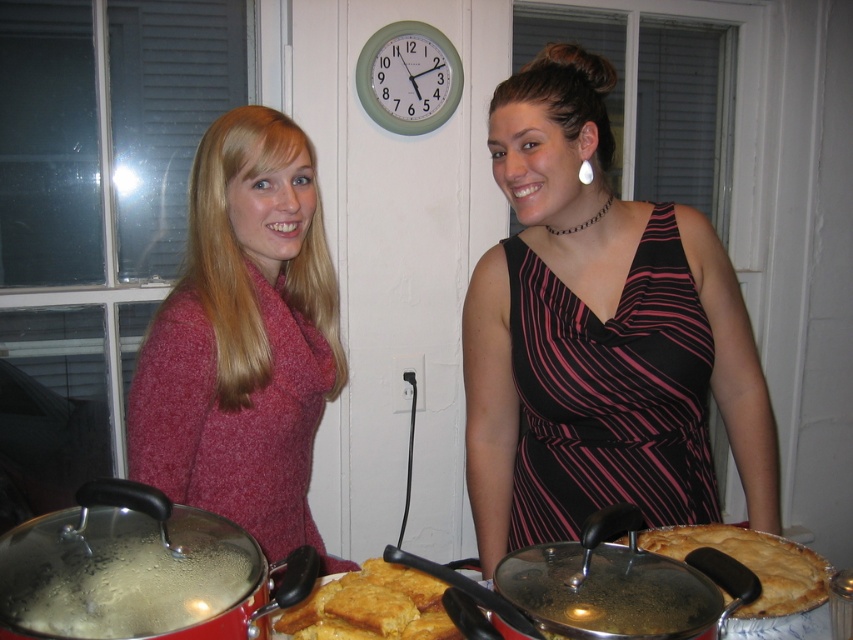
Question: Is black striped dress at center further to camera compared to golden brown crusty bread at center?

Choices:
 (A) yes
 (B) no

Answer: (A)

Question: Is matte red sweater at center closer to camera compared to golden brown crusty bread at center?

Choices:
 (A) no
 (B) yes

Answer: (A)

Question: In this image, where is black striped dress at center located relative to matte red sweater at center?

Choices:
 (A) left
 (B) right

Answer: (B)

Question: Which object is positioned farthest from the black striped dress at center?

Choices:
 (A) golden flaky pie at center right
 (B) matte red sweater at center
 (C) golden brown crusty bread at center

Answer: (C)

Question: Based on their relative distances, which object is nearer to the matte red sweater at center?

Choices:
 (A) golden flaky pie at center right
 (B) black striped dress at center
 (C) golden brown crusty bread at center

Answer: (B)

Question: Which of the following is the farthest from the observer?

Choices:
 (A) golden brown crusty bread at center
 (B) golden flaky pie at center right
 (C) matte red sweater at center
 (D) black striped dress at center

Answer: (C)